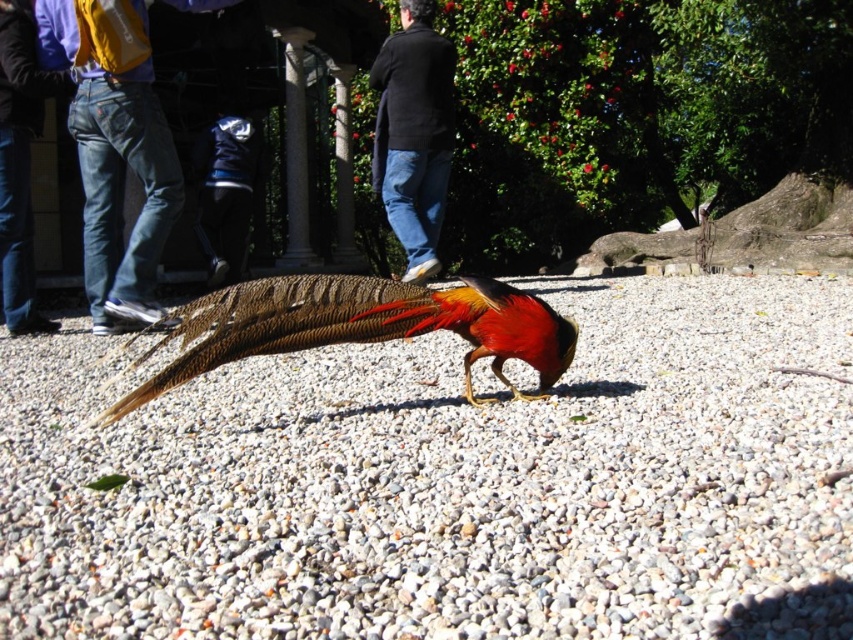
You are a gardener trying to place a black matte sweater at center on the gray gravel at center. Can the sweater fit horizontally on the gravel without overlapping the edges?

The gray gravel at center is wider than the black matte sweater at center, so yes, the sweater can fit horizontally on the gravel without overlapping the edges.

You are a delivery robot with a package that needs to be placed on the black matte sweater at center. You are currently positioned on the gray gravel at center. Can you reach the sweater without moving more than 7 feet?

The distance between the gray gravel at center and the black matte sweater at center is 7.33 feet, so the robot cannot reach the sweater without moving more than 7 feet.

You are standing at the origin point in the image. Which of the two points, point (152, 241) or point (403, 99), is closer to you?

Point (152, 241) is closer to you because it is in front of point (403, 99).